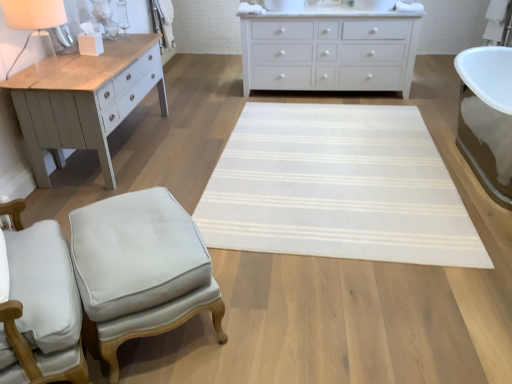
Question: From a real-world perspective, does white matte table lamp at upper left sit lower than white fabric chair at lower left?

Choices:
 (A) no
 (B) yes

Answer: (A)

Question: Is the depth of white matte table lamp at upper left less than that of white fabric chair at lower left?

Choices:
 (A) no
 (B) yes

Answer: (A)

Question: Is white matte table lamp at upper left shorter than white fabric chair at lower left?

Choices:
 (A) yes
 (B) no

Answer: (A)

Question: Is white matte table lamp at upper left surrounding white fabric chair at lower left?

Choices:
 (A) no
 (B) yes

Answer: (A)

Question: Considering the relative positions of white matte table lamp at upper left and white fabric chair at lower left in the image provided, is white matte table lamp at upper left behind white fabric chair at lower left?

Choices:
 (A) no
 (B) yes

Answer: (B)

Question: Is white matte table lamp at upper left oriented towards white fabric chair at lower left?

Choices:
 (A) yes
 (B) no

Answer: (B)

Question: Is the depth of light gray fabric stool at lower left greater than that of white woven mat at center?

Choices:
 (A) no
 (B) yes

Answer: (A)

Question: Can you confirm if light gray fabric stool at lower left is bigger than white woven mat at center?

Choices:
 (A) yes
 (B) no

Answer: (A)

Question: Considering the relative positions of light gray fabric stool at lower left and white woven mat at center in the image provided, is light gray fabric stool at lower left to the right of white woven mat at center from the viewer's perspective?

Choices:
 (A) no
 (B) yes

Answer: (A)

Question: From the image's perspective, is light gray fabric stool at lower left below white woven mat at center?

Choices:
 (A) yes
 (B) no

Answer: (A)

Question: From a real-world perspective, is light gray fabric stool at lower left positioned over white woven mat at center based on gravity?

Choices:
 (A) no
 (B) yes

Answer: (B)

Question: Is light gray fabric stool at lower left next to white woven mat at center?

Choices:
 (A) no
 (B) yes

Answer: (A)

Question: Considering the relative positions of white fabric chair at lower left and white woven mat at center in the image provided, is white fabric chair at lower left to the right of white woven mat at center from the viewer's perspective?

Choices:
 (A) no
 (B) yes

Answer: (A)